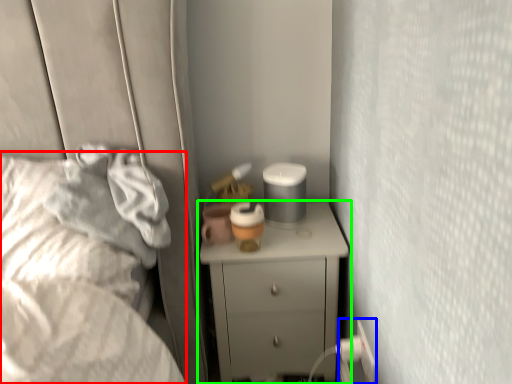
Question: Based on their relative distances, which object is farther from bed (highlighted by a red box)? Choose from electric outlet (highlighted by a blue box) and chest of drawers (highlighted by a green box).

Choices:
 (A) electric outlet
 (B) chest of drawers

Answer: (A)